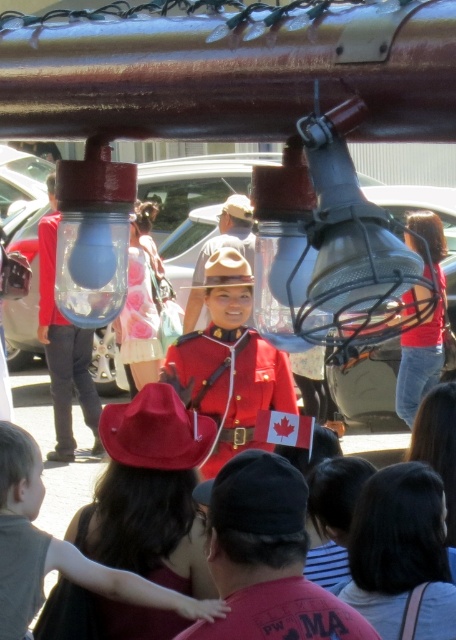
Does matte red cowboy hat at lower left have a larger size compared to red felt cowboy hat at center?

Correct, matte red cowboy hat at lower left is larger in size than red felt cowboy hat at center.

Can you confirm if matte red cowboy hat at lower left is positioned below red felt cowboy hat at center?

Indeed, matte red cowboy hat at lower left is positioned under red felt cowboy hat at center.

Which is in front, point (0, 593) or point (171, 461)?

Point (0, 593) is in front.

Locate an element on the screen. The height and width of the screenshot is (640, 456). matte red cowboy hat at lower left is located at coordinates (57, 548).

Between red uniform at center and matte red cowboy hat at lower left, which one appears on the right side from the viewer's perspective?

red uniform at center

Is red uniform at center above matte red cowboy hat at lower left?

Yes, red uniform at center is above matte red cowboy hat at lower left.

Measure the distance between point (219, 339) and camera.

Point (219, 339) is 8.29 meters from camera.

The width and height of the screenshot is (456, 640). Identify the location of red uniform at center. (229, 364).

Is matte red cowboy hat at lower left above brown felt cowboy hat at center?

Incorrect, matte red cowboy hat at lower left is not positioned above brown felt cowboy hat at center.

In order to click on matte red cowboy hat at lower left in this screenshot , I will do `click(57, 548)`.

Between point (31, 456) and point (248, 282), which one is positioned behind?

The point (248, 282) is more distant.

You are a GUI agent. You are given a task and a screenshot of the screen. Output one action in this format:
    pyautogui.click(x=<x>, y=<y>)
    Task: Click on the matte red cowboy hat at lower left
    
    Given the screenshot: What is the action you would take?
    pyautogui.click(x=57, y=548)